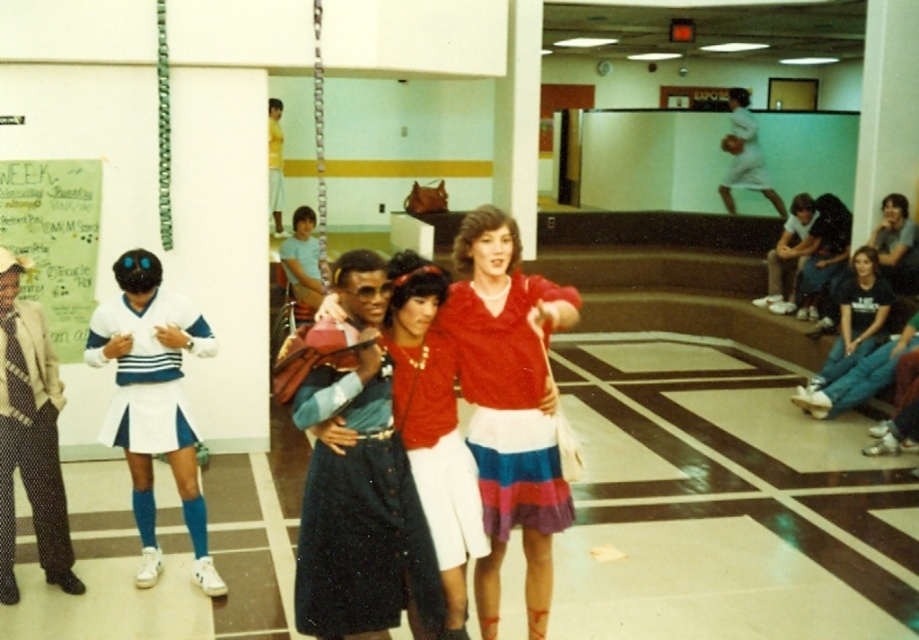
What do you see at coordinates (823, 259) in the screenshot?
I see `matte black hair at center` at bounding box center [823, 259].

The height and width of the screenshot is (640, 919). Describe the element at coordinates (823, 259) in the screenshot. I see `matte black hair at center` at that location.

At what (x,y) coordinates should I click in order to perform the action: click on matte black hair at center. Please return your answer as a coordinate pair (x, y). Looking at the image, I should click on (823, 259).

Locate an element on the screen. white fabric skirt at center is located at coordinates (153, 401).

Measure the distance between white fabric skirt at center and camera.

white fabric skirt at center is 16.46 feet away from camera.

Where is `white fabric skirt at center`? The height and width of the screenshot is (640, 919). white fabric skirt at center is located at coordinates (153, 401).

Can you confirm if matte red sweater at center is positioned below polka dot pants at left?

No, matte red sweater at center is not below polka dot pants at left.

Is point (508, 273) behind point (47, 513)?

No, (508, 273) is closer to viewer.

At what (x,y) coordinates should I click in order to perform the action: click on matte red sweater at center. Please return your answer as a coordinate pair (x, y). The height and width of the screenshot is (640, 919). Looking at the image, I should click on (509, 404).